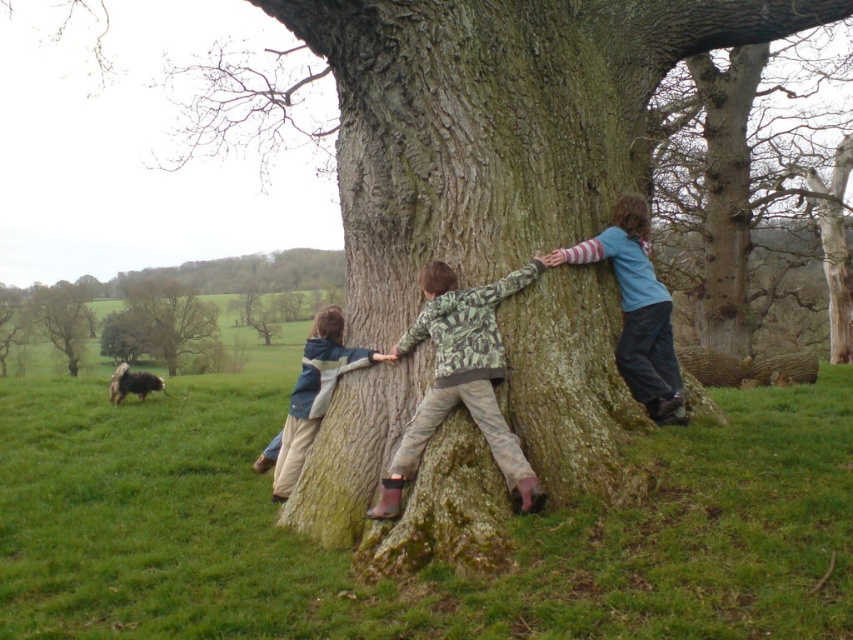
Which is behind, point (498, 460) or point (126, 387)?

The point (126, 387) is behind.

Can you confirm if camouflage-patterned jacket at center is thinner than fuzzy wool dog at lower left?

No.

Where is `camouflage-patterned jacket at center`? This screenshot has width=853, height=640. camouflage-patterned jacket at center is located at coordinates (461, 380).

Can you confirm if camouflage-patterned jacket at center is wider than camouflage jacket at lower left?

Yes, camouflage-patterned jacket at center is wider than camouflage jacket at lower left.

Who is positioned more to the right, camouflage-patterned jacket at center or camouflage jacket at lower left?

Positioned to the right is camouflage-patterned jacket at center.

Between point (486, 385) and point (349, 355), which one is positioned behind?

The point (349, 355) is more distant.

At what (x,y) coordinates should I click in order to perform the action: click on camouflage-patterned jacket at center. Please return your answer as a coordinate pair (x, y). The image size is (853, 640). Looking at the image, I should click on (461, 380).

Does green mossy tree trunk at lower left have a lesser height compared to camouflage jacket at lower left?

No.

Is point (204, 310) less distant than point (280, 492)?

No, (204, 310) is behind (280, 492).

You are a GUI agent. You are given a task and a screenshot of the screen. Output one action in this format:
    pyautogui.click(x=<x>, y=<y>)
    Task: Click on the green mossy tree trunk at lower left
    The width and height of the screenshot is (853, 640).
    Given the screenshot: What is the action you would take?
    pyautogui.click(x=160, y=323)